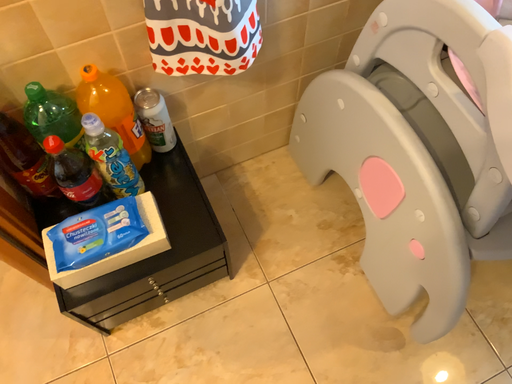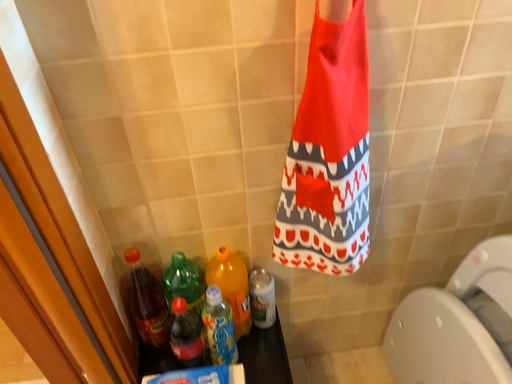
Question: Which way did the camera rotate in the video?

Choices:
 (A) rotated left
 (B) rotated right

Answer: (A)